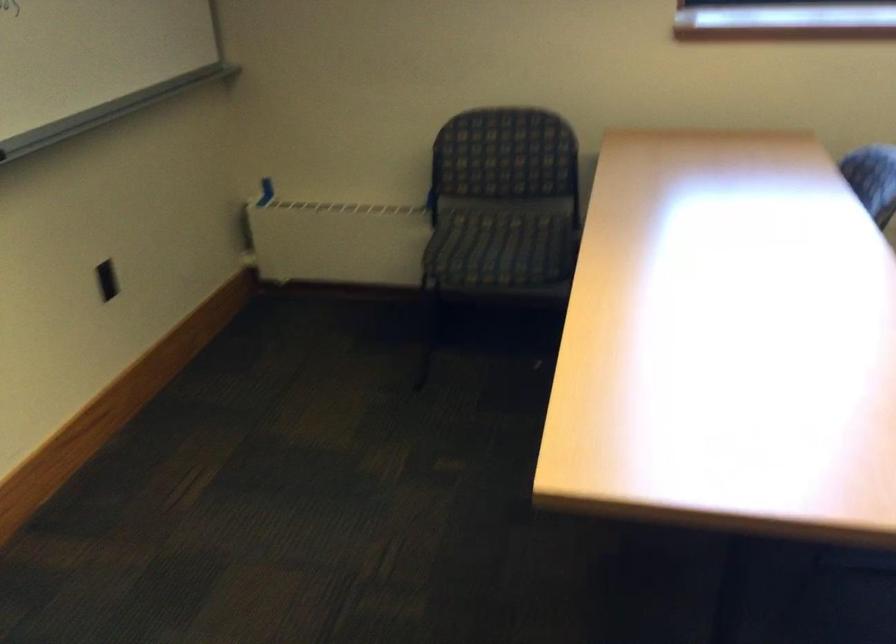
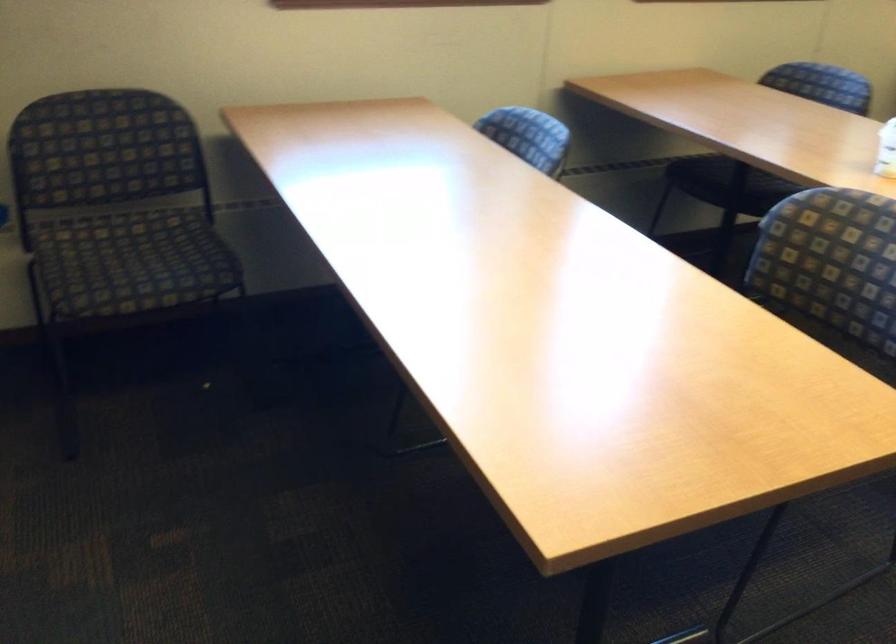
The point at (489, 242) is marked in the first image. Where is the corresponding point in the second image?

(131, 261)